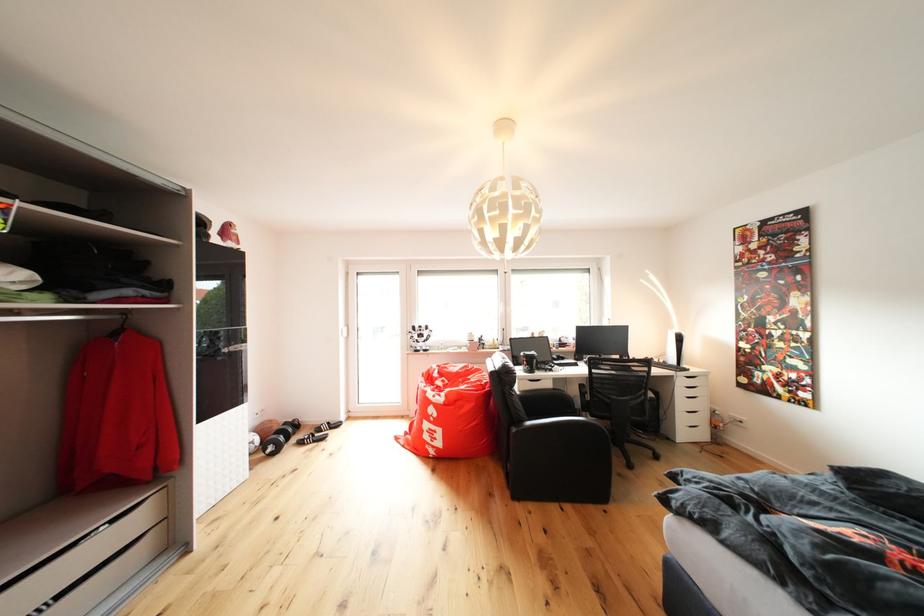
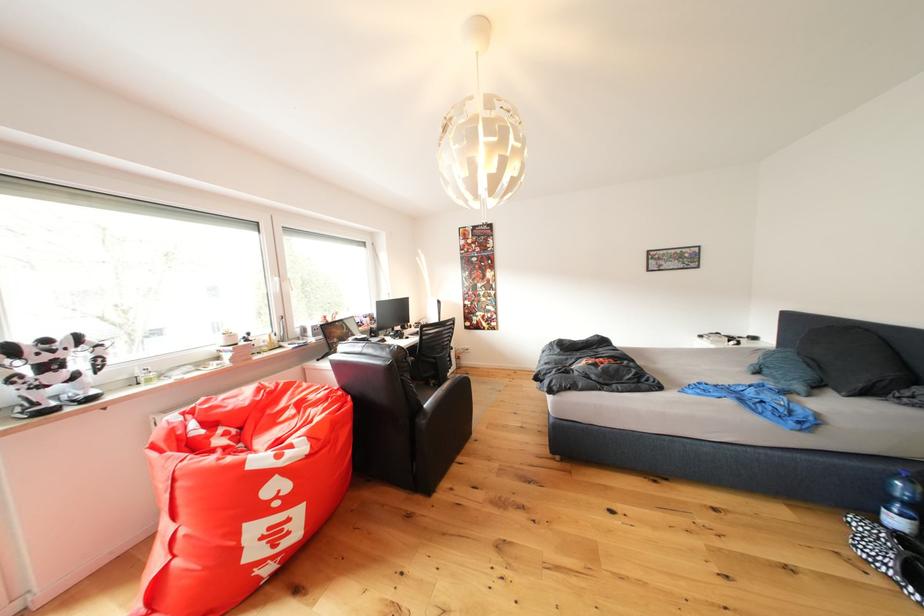
Find the pixel in the second image that matches point (538, 429) in the first image.

(434, 410)